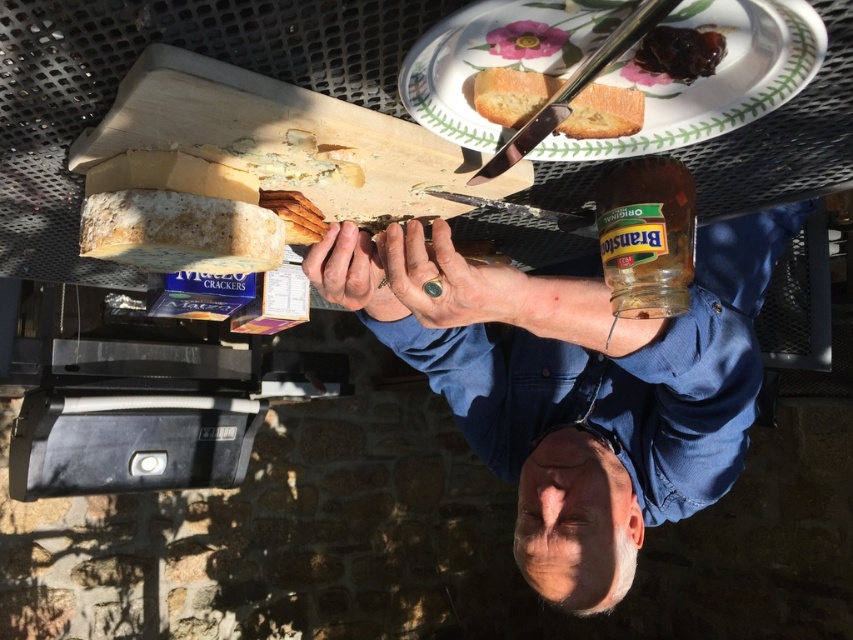
Question: Which point is closer to the camera?

Choices:
 (A) (433, 225)
 (B) (708, 54)

Answer: (B)

Question: Which point is closer to the camera?

Choices:
 (A) white ceramic plate at upper center
 (B) golden brown crusty bread at upper center
 (C) silver metallic knife at upper center
 (D) shiny dark brown jam at upper right

Answer: (A)

Question: Does white ceramic plate at upper center appear on the right side of wooden cutting board at center?

Choices:
 (A) no
 (B) yes

Answer: (B)

Question: Among these objects, which one is farthest from the camera?

Choices:
 (A) wooden cutting board at center
 (B) white crumbly cheese at center

Answer: (B)

Question: Is white ceramic plate at upper center smaller than dry skin at center?

Choices:
 (A) no
 (B) yes

Answer: (A)

Question: Does golden brown crusty bread at upper center have a greater width compared to dry skin at center?

Choices:
 (A) no
 (B) yes

Answer: (B)